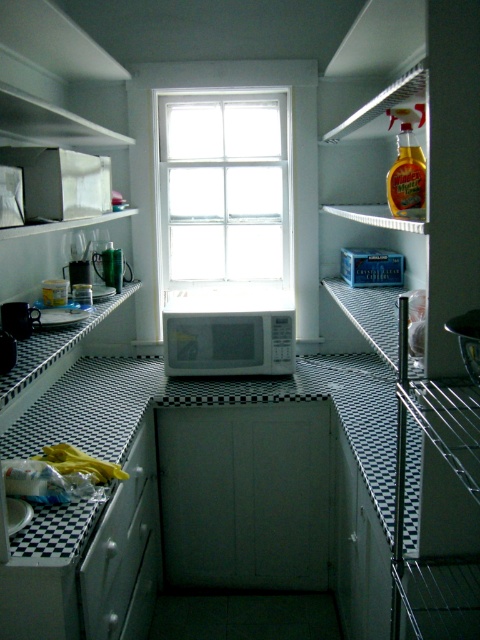
You are standing in the kitchen and want to place a new sticker on the metallic silver fridge at right. The sticker requires a specific placement at coordinates point (419, 323). Can you confirm if this point is on the metallic silver fridge at right?

Yes, the point (419, 323) is on the metallic silver fridge at right, so the sticker can be placed there.

You are organizing the kitchen and need to place a new 18 inch tall appliance. The metallic silver fridge at right and the white glossy drawer at lower left are in the way. Which object should you move to make space?

The metallic silver fridge at right is taller than the white glossy drawer at lower left, so you should move the metallic silver fridge at right to make space for the new appliance since it is taller and might require more clearance.

Based on the photo, you are a chef standing in the kitchen and need to reach both the white glass window at center and the white matte exhaust hood at upper center. Which object is positioned higher up in the kitchen?

The white matte exhaust hood at upper center is positioned higher up in the kitchen since it is above the white glass window at center.